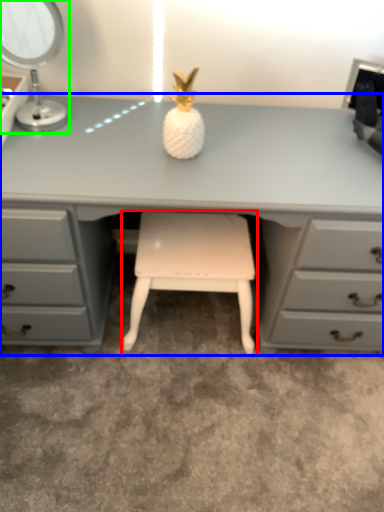
Question: Which object is positioned closest to stool (highlighted by a red box)? Select from desk (highlighted by a blue box) and table lamp (highlighted by a green box).

Choices:
 (A) desk
 (B) table lamp

Answer: (A)